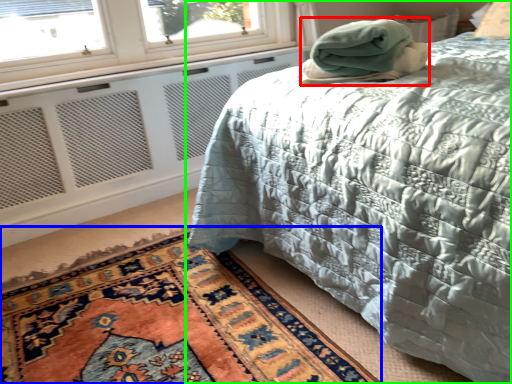
Question: Which is farther away from blanket (highlighted by a red box)? mat (highlighted by a blue box) or bed (highlighted by a green box)?

Choices:
 (A) mat
 (B) bed

Answer: (A)